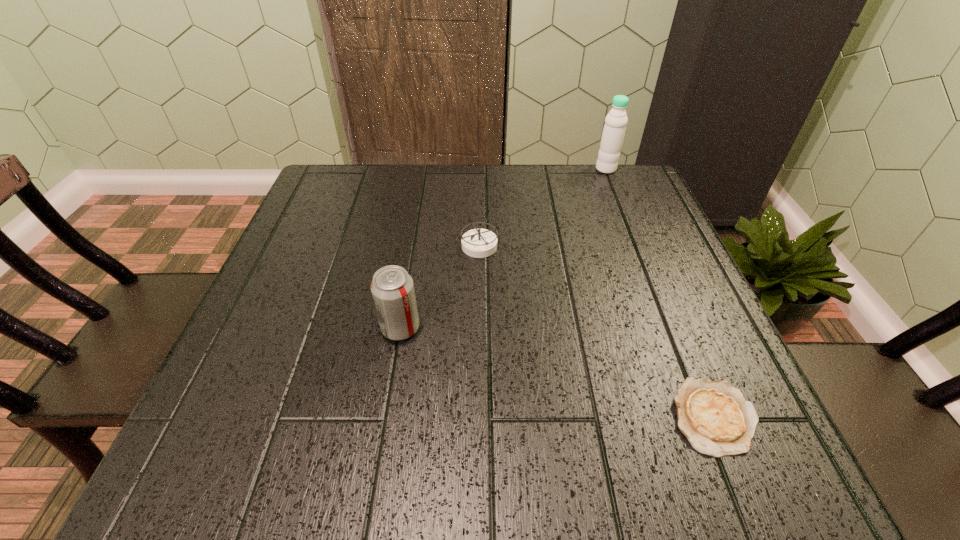
This screenshot has width=960, height=540. Find the location of `free space located on the back of the second shortest object`. free space located on the back of the second shortest object is located at coordinates (479, 172).

In order to click on free spot located on the back of the nearest object in this screenshot , I will do `click(656, 278)`.

Image resolution: width=960 pixels, height=540 pixels. I want to click on object present at the far edge, so point(616,120).

Locate an element on the screen. object at the near edge is located at coordinates (714, 416).

Identify the location of water bottle located at the right edge. This screenshot has width=960, height=540. (616, 120).

Find the location of a particular element. Image resolution: width=960 pixels, height=540 pixels. quiche that is at the right edge is located at coordinates (714, 416).

Find the location of `object at the far right corner`. object at the far right corner is located at coordinates (616, 120).

Locate an element on the screen. The image size is (960, 540). object at the near right corner is located at coordinates (714, 416).

Find the location of a particular element. The height and width of the screenshot is (540, 960). free region at the far edge of the desktop is located at coordinates (559, 169).

The height and width of the screenshot is (540, 960). Find the location of `vacant region at the near edge`. vacant region at the near edge is located at coordinates (610, 475).